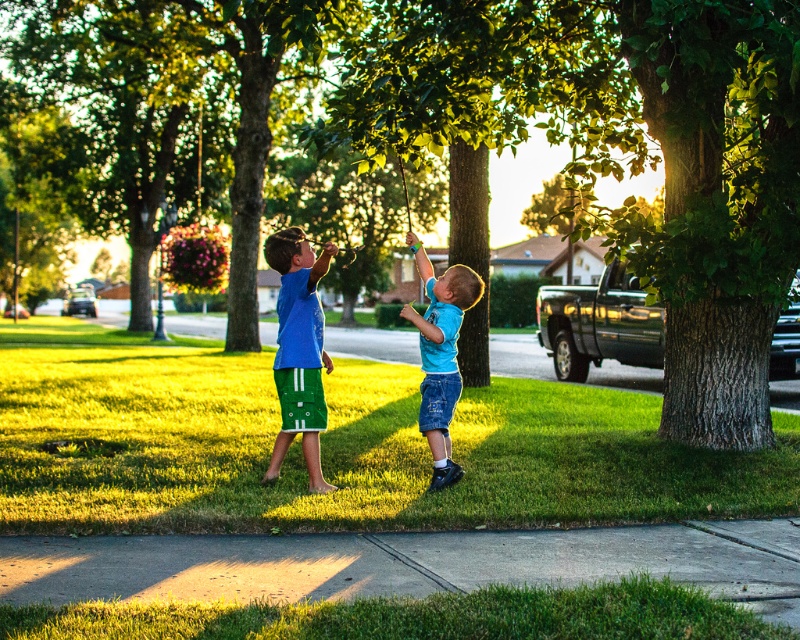
Question: Which point is farther to the camera?

Choices:
 (A) (432, 348)
 (B) (772, 524)
 (C) (282, 404)
 (D) (10, 378)

Answer: (D)

Question: Which object appears closest to the camera in this image?

Choices:
 (A) green leafy tree at center
 (B) green grass at center
 (C) green fabric shorts at center
 (D) blue denim shorts at center

Answer: (B)

Question: Observing the image, what is the correct spatial positioning of green grass at center in reference to green fabric shorts at center?

Choices:
 (A) below
 (B) above

Answer: (A)

Question: Does green leafy tree at center appear over gray concrete pavement at lower center?

Choices:
 (A) yes
 (B) no

Answer: (A)

Question: Considering the real-world distances, which object is farthest from the green fabric shorts at center?

Choices:
 (A) green leafy tree at center
 (B) gray concrete pavement at lower center
 (C) blue denim shorts at center

Answer: (A)

Question: Does green grass at center have a larger size compared to gray concrete pavement at lower center?

Choices:
 (A) yes
 (B) no

Answer: (A)